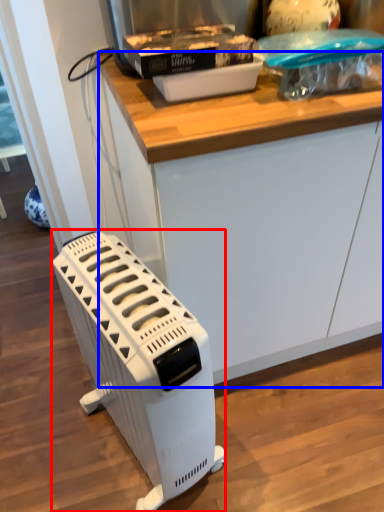
Question: Which point is further to the camera, home appliance (highlighted by a red box) or counter (highlighted by a blue box)?

Choices:
 (A) home appliance
 (B) counter

Answer: (B)